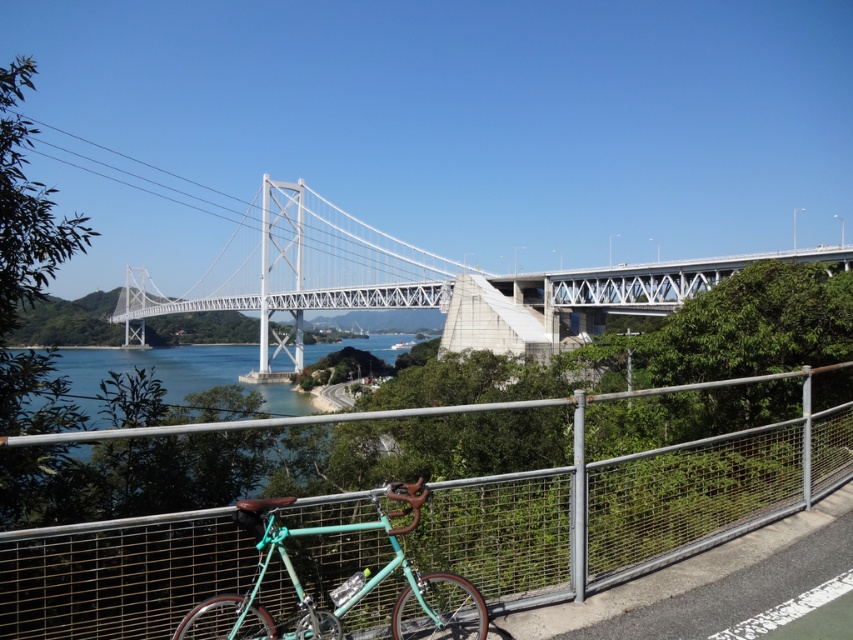
Question: Which point is closer to the camera?

Choices:
 (A) metal mesh fence at lower center
 (B) teal matte bicycle at center

Answer: (B)

Question: Estimate the real-world distances between objects in this image. Which object is farther from the teal matte bicycle at center?

Choices:
 (A) metal mesh fence at lower center
 (B) white metallic suspension bridge at center

Answer: (B)

Question: Can you confirm if metal mesh fence at lower center is positioned to the left of white metallic suspension bridge at center?

Choices:
 (A) no
 (B) yes

Answer: (A)

Question: Is metal mesh fence at lower center positioned before white metallic suspension bridge at center?

Choices:
 (A) yes
 (B) no

Answer: (A)

Question: Can you confirm if metal mesh fence at lower center is thinner than teal matte bicycle at center?

Choices:
 (A) no
 (B) yes

Answer: (B)

Question: Which point is closer to the camera taking this photo?

Choices:
 (A) (144, 280)
 (B) (352, 524)

Answer: (B)